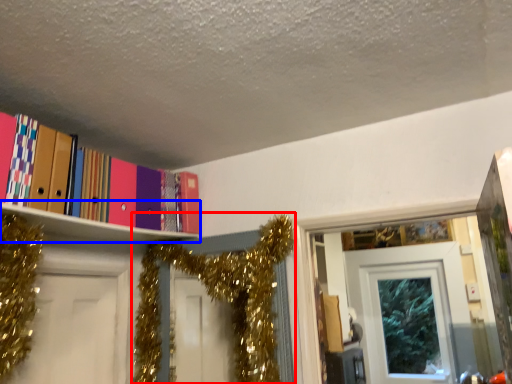
Question: Which point is closer to the camera, christmas decoration (highlighted by a red box) or shelf (highlighted by a blue box)?

Choices:
 (A) christmas decoration
 (B) shelf

Answer: (B)